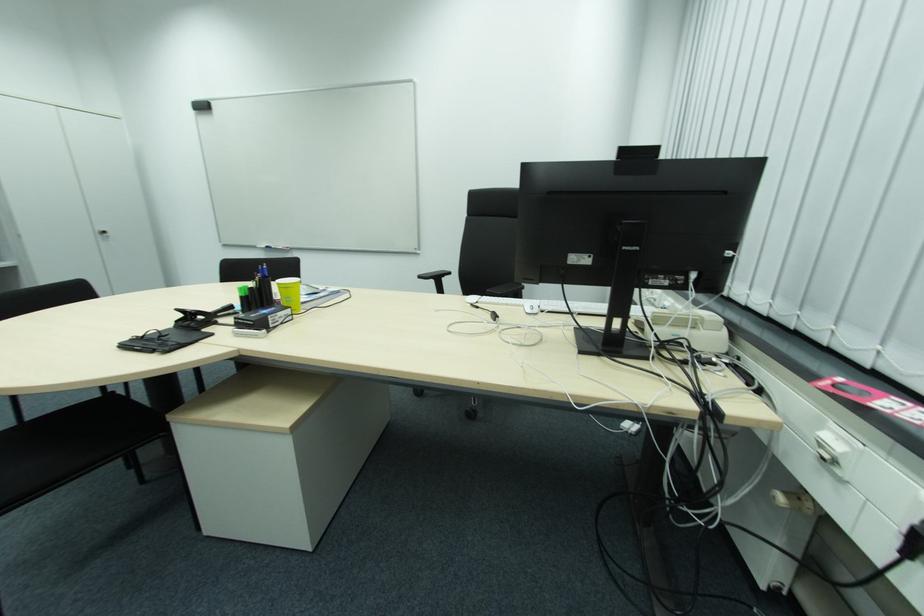
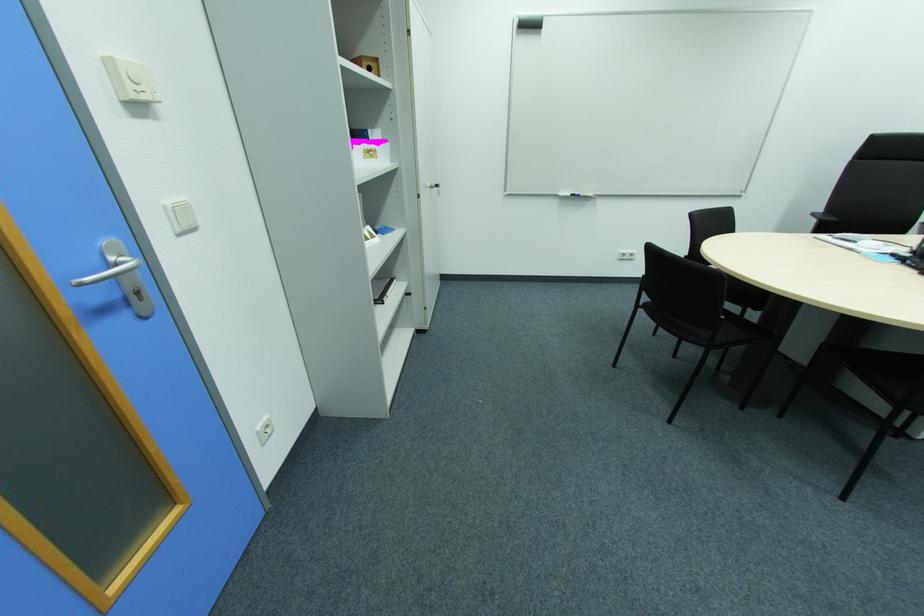
Where in the second image is the point corresponding to point 280,248 from the first image?

(588, 195)